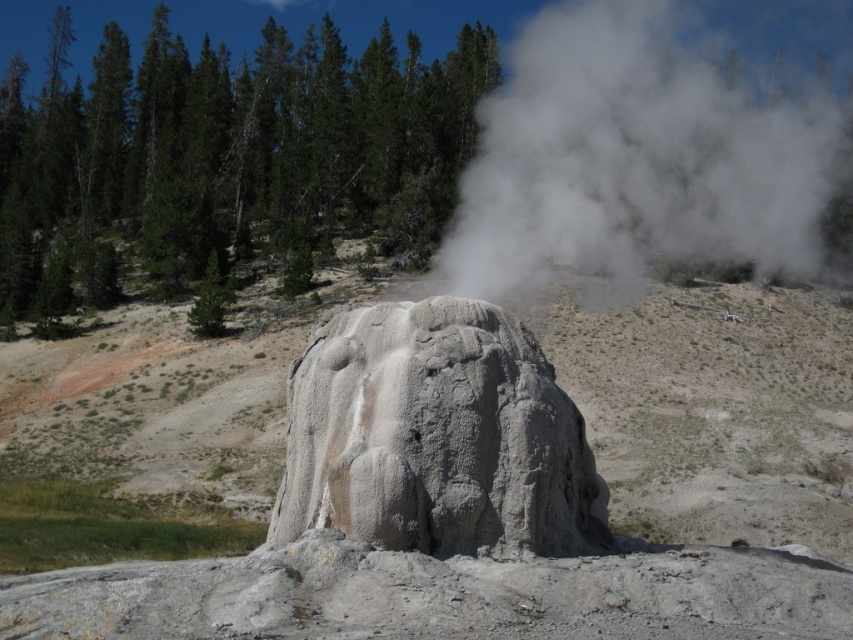
You are a geologist studying the geyser and notice the white vapor at center. Based on its position, can you determine if it is closer to the top or bottom of the image?

The white vapor at center is located at point coordinates approximately 0.252 on the x and 0.743 on the y axis. Since the y coordinate is closer to 1, it is positioned closer to the bottom of the image.

You are a geologist examining the image of a geothermal area. You need to determine which object is wider between the gray rock formation at center and the gray rough rock at center. Based on the scene, which one has a greater width?

The gray rock formation at center has a greater width than the gray rough rock at center.

You are a geologist standing at the edge of this geothermal area. You need to collect a sample from the gray rock formation at center. If your sampling tool has a maximum reach of 9 meters, will you be able to collect the sample without moving closer?

The gray rock formation at center is 9.20 meters away from the camera. Since your tool only reaches 9 meters, you cannot collect the sample without moving closer.